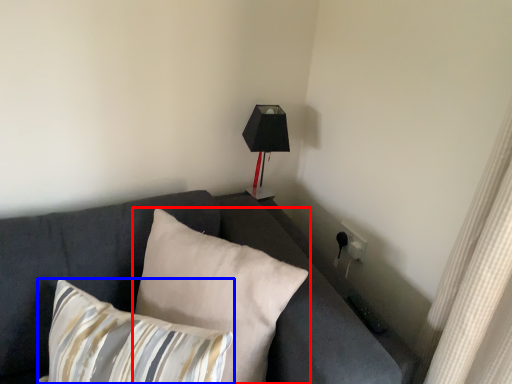
Question: Which point is further to the camera, pillow (highlighted by a red box) or pillow (highlighted by a blue box)?

Choices:
 (A) pillow
 (B) pillow

Answer: (A)